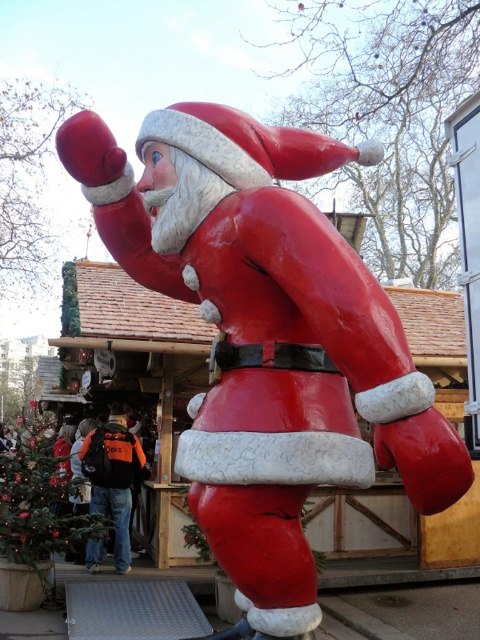
Question: Which object is farther from the camera taking this photo?

Choices:
 (A) orange backpack at center
 (B) shiny plastic santa at center

Answer: (A)

Question: Which point is closer to the camera?

Choices:
 (A) (251, 483)
 (B) (137, 464)

Answer: (A)

Question: Is shiny plastic santa at center smaller than orange backpack at center?

Choices:
 (A) yes
 (B) no

Answer: (B)

Question: Can you confirm if shiny plastic santa at center is smaller than orange backpack at center?

Choices:
 (A) yes
 (B) no

Answer: (B)

Question: Is shiny plastic santa at center further to camera compared to orange backpack at center?

Choices:
 (A) no
 (B) yes

Answer: (A)

Question: Which point appears farthest from the camera in this image?

Choices:
 (A) (288, 536)
 (B) (129, 534)

Answer: (B)